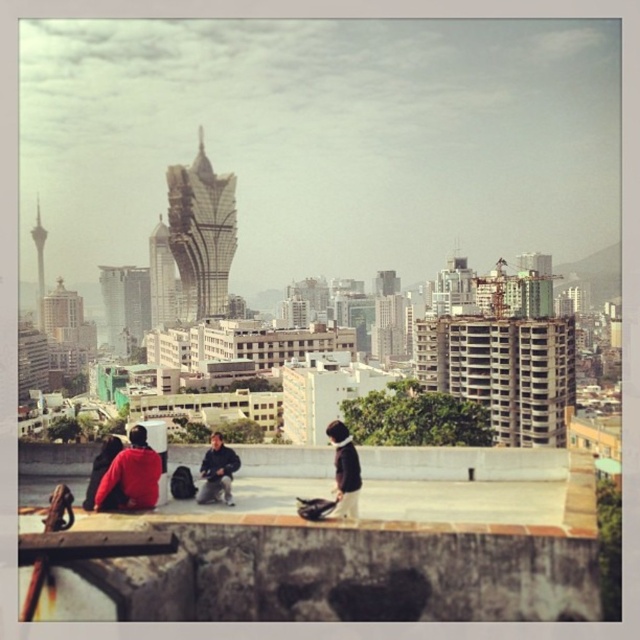
Can you confirm if silver metallic tower at center is smaller than red matte jacket at lower left?

No.

What do you see at coordinates (202, 234) in the screenshot? I see `silver metallic tower at center` at bounding box center [202, 234].

Describe the element at coordinates (202, 234) in the screenshot. The width and height of the screenshot is (640, 640). I see `silver metallic tower at center` at that location.

This screenshot has width=640, height=640. What are the coordinates of `silver metallic tower at center` in the screenshot? It's located at (202, 234).

Does shiny glass tower at center have a larger size compared to dark blue jeans at center?

No.

Which is behind, point (168, 312) or point (214, 448)?

Positioned behind is point (168, 312).

Which is behind, point (170, 321) or point (205, 472)?

Positioned behind is point (170, 321).

Image resolution: width=640 pixels, height=640 pixels. What are the coordinates of `shiny glass tower at center` in the screenshot? It's located at (161, 276).

This screenshot has height=640, width=640. Identify the location of red matte jacket at lower left. (124, 476).

Is red matte jacket at lower left positioned at the back of shiny glass tower at center?

No, it is not.

Who is more forward, (120, 467) or (164, 246)?

Positioned in front is point (120, 467).

Identify the location of red matte jacket at lower left. (124, 476).